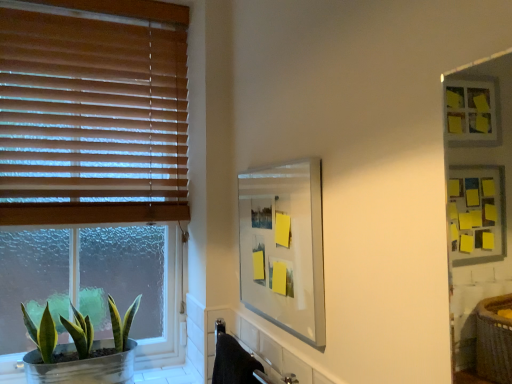
Question: Should I look upward or downward to see clear glass mirror at center?

Choices:
 (A) down
 (B) up

Answer: (A)

Question: Is clear glass mirror at center closer to the viewer compared to wooden blinds at left?

Choices:
 (A) no
 (B) yes

Answer: (B)

Question: Can you confirm if clear glass mirror at center is bigger than wooden blinds at left?

Choices:
 (A) no
 (B) yes

Answer: (A)

Question: Is clear glass mirror at center turned away from wooden blinds at left?

Choices:
 (A) no
 (B) yes

Answer: (A)

Question: Can we say clear glass mirror at center lies outside wooden blinds at left?

Choices:
 (A) yes
 (B) no

Answer: (A)

Question: Would you say clear glass mirror at center is a long distance from wooden blinds at left?

Choices:
 (A) no
 (B) yes

Answer: (A)

Question: From a real-world perspective, is clear glass mirror at center physically above wooden blinds at left?

Choices:
 (A) yes
 (B) no

Answer: (B)

Question: Does green matte plant at lower left come in front of clear glass mirror at center?

Choices:
 (A) yes
 (B) no

Answer: (B)

Question: Is green matte plant at lower left far from clear glass mirror at center?

Choices:
 (A) no
 (B) yes

Answer: (A)

Question: Is green matte plant at lower left taller than clear glass mirror at center?

Choices:
 (A) no
 (B) yes

Answer: (A)

Question: Is clear glass mirror at center located within green matte plant at lower left?

Choices:
 (A) no
 (B) yes

Answer: (A)

Question: Does green matte plant at lower left lie behind clear glass mirror at center?

Choices:
 (A) yes
 (B) no

Answer: (A)

Question: Is green matte plant at lower left wider than clear glass mirror at center?

Choices:
 (A) no
 (B) yes

Answer: (B)

Question: Does clear glass mirror at center have a greater height compared to green matte plant at lower left?

Choices:
 (A) no
 (B) yes

Answer: (B)